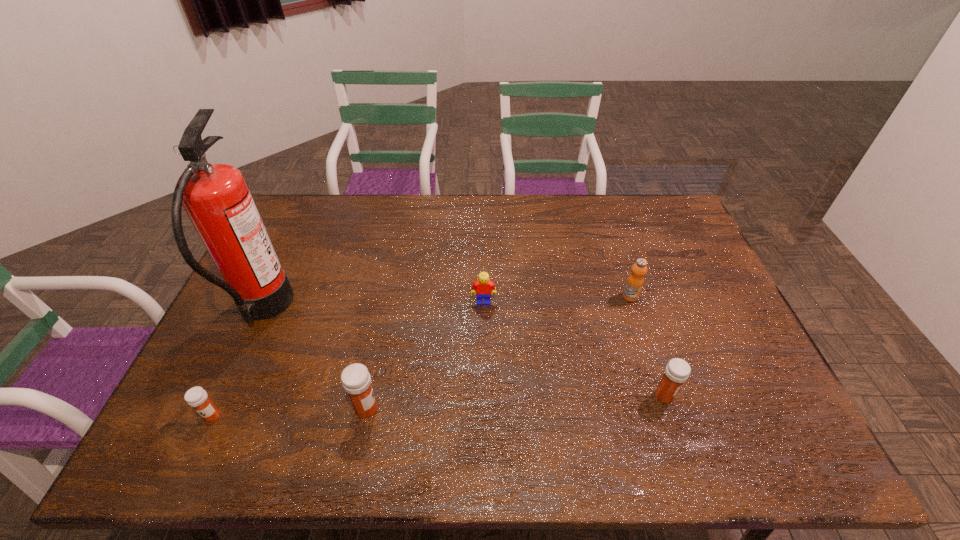
Identify the location of the shortest medicine. (196, 397).

Locate an element on the screen. the leftmost medicine is located at coordinates (196, 397).

Identify the location of the second medicine from left to right. (356, 380).

You are a GUI agent. You are given a task and a screenshot of the screen. Output one action in this format:
    pyautogui.click(x=<x>, y=<y>)
    Task: Click on the fourth object from right to left
    The image size is (960, 540).
    Given the screenshot: What is the action you would take?
    pyautogui.click(x=356, y=380)

Locate an element on the screen. Image resolution: width=960 pixels, height=540 pixels. the second shortest medicine is located at coordinates (677, 371).

Locate an element on the screen. Image resolution: width=960 pixels, height=540 pixels. orange juice is located at coordinates (635, 281).

Where is `fire extinguisher`? fire extinguisher is located at coordinates (216, 198).

At what (x,y) coordinates should I click in order to perform the action: click on the fourth object from left to right. Please return your answer as a coordinate pair (x, y). This screenshot has height=540, width=960. Looking at the image, I should click on (483, 286).

Identify the location of vacant area situated on the label side of the third object from left to right. (516, 409).

This screenshot has height=540, width=960. In order to click on vacant position located 0.230m on the label side of the second tallest medicine in this screenshot , I will do `click(768, 395)`.